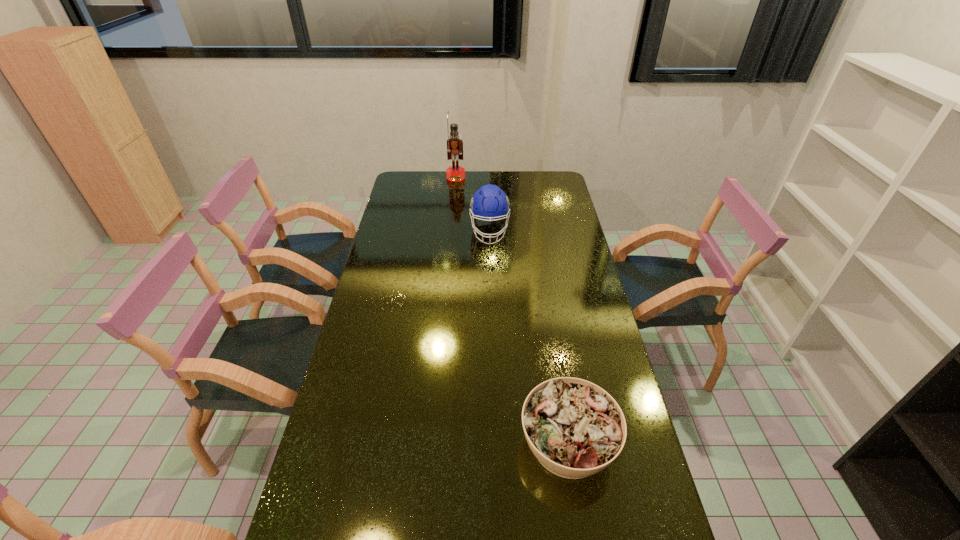
Find the location of a particular element. This screenshot has height=540, width=960. the closest object relative to the shortest object is located at coordinates (489, 202).

In order to click on vacant point that satisfies the following two spatial constraints: 1. on the front-facing side of the salad; 2. on the left side of the football helmet in this screenshot , I will do `click(495, 442)`.

I want to click on free space that satisfies the following two spatial constraints: 1. on the front-facing side of the tallest object; 2. on the left side of the salad, so click(x=433, y=442).

Identify the location of blank space that satisfies the following two spatial constraints: 1. on the front-facing side of the second farthest object; 2. on the left side of the salad. Image resolution: width=960 pixels, height=540 pixels. (495, 442).

Locate an element on the screen. Image resolution: width=960 pixels, height=540 pixels. vacant region that satisfies the following two spatial constraints: 1. on the front-facing side of the shortest object; 2. on the right side of the leftmost object is located at coordinates (433, 442).

The width and height of the screenshot is (960, 540). In order to click on vacant position in the image that satisfies the following two spatial constraints: 1. on the front-facing side of the shortest object; 2. on the right side of the leftmost object in this screenshot , I will do `click(433, 442)`.

This screenshot has width=960, height=540. What are the coordinates of `vacant region that satisfies the following two spatial constraints: 1. on the front-facing side of the second tallest object; 2. on the left side of the salad` in the screenshot? It's located at (495, 442).

This screenshot has height=540, width=960. Identify the location of free space that satisfies the following two spatial constraints: 1. on the front-facing side of the second farthest object; 2. on the right side of the shortest object. (495, 442).

Locate an element on the screen. The height and width of the screenshot is (540, 960). free location that satisfies the following two spatial constraints: 1. on the front-facing side of the salad; 2. on the left side of the football helmet is located at coordinates (495, 442).

Where is `vacant area that satisfies the following two spatial constraints: 1. on the front-facing side of the salad; 2. on the right side of the second tallest object`? vacant area that satisfies the following two spatial constraints: 1. on the front-facing side of the salad; 2. on the right side of the second tallest object is located at coordinates (495, 442).